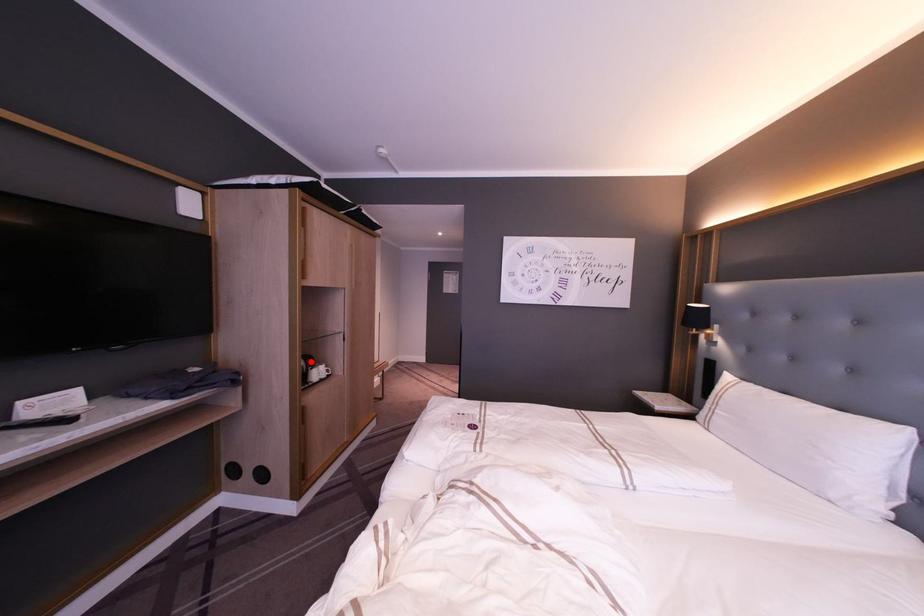
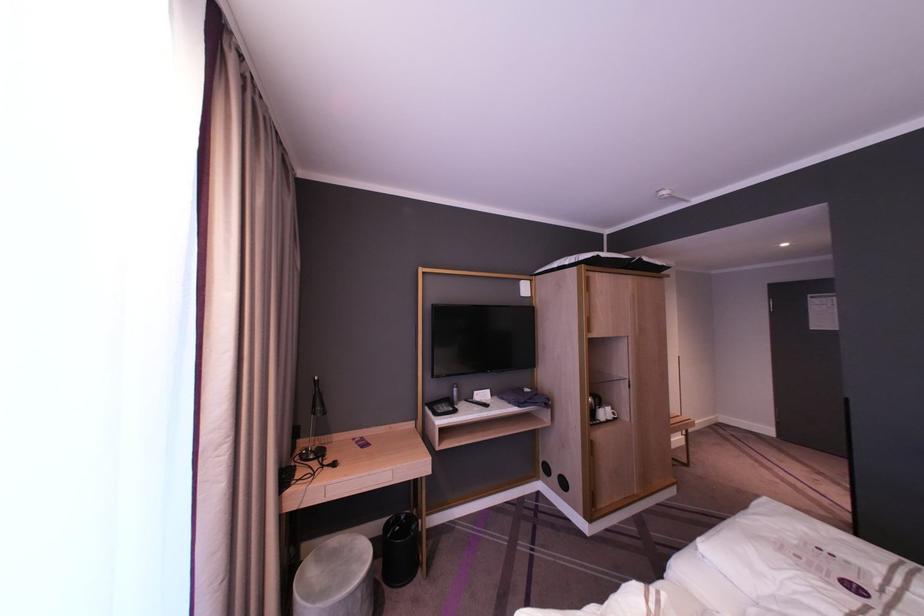
The point at the highlighted location is marked in the first image. Where is the corresponding point in the second image?

(599, 400)